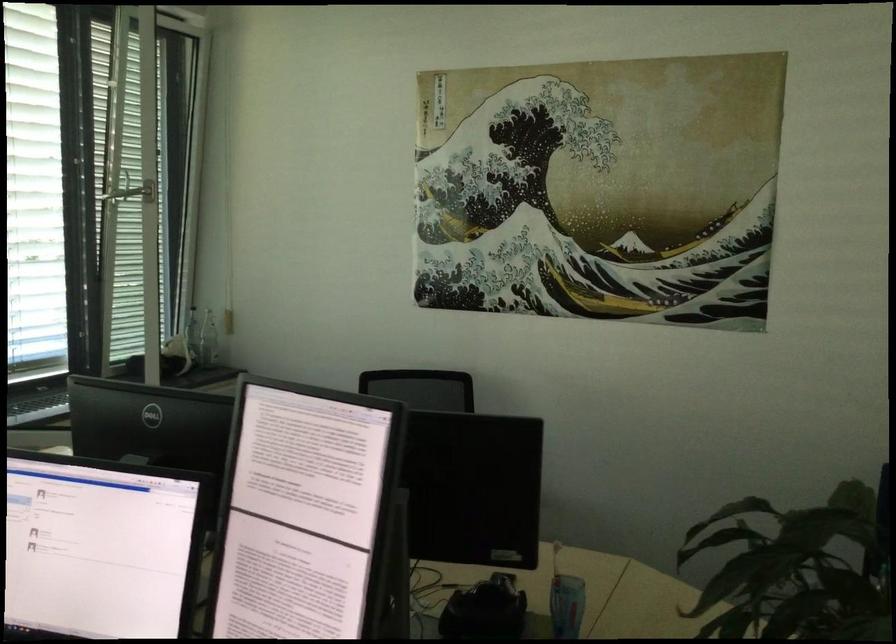
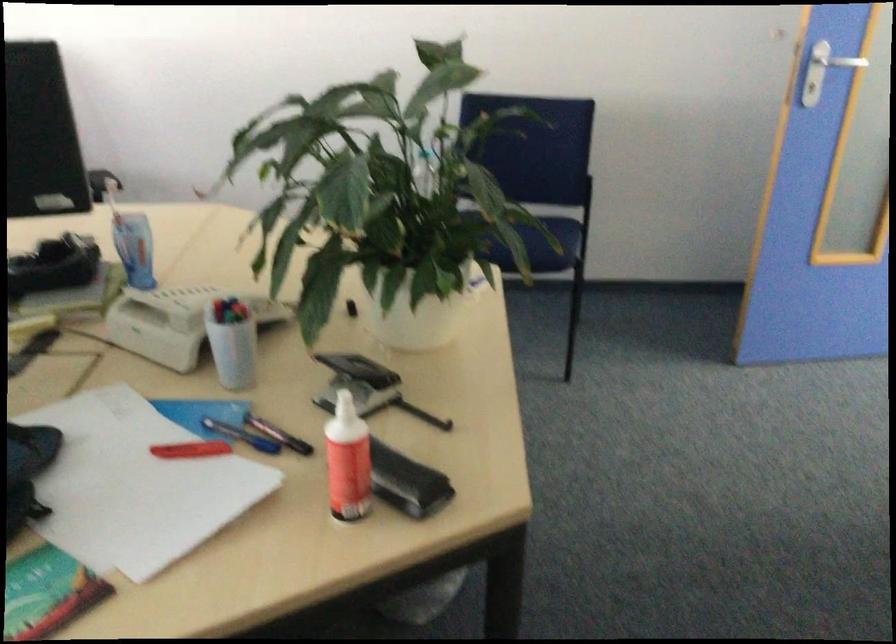
Based on the continuous images, in which direction is the camera rotating?

The camera rotated toward right-down.